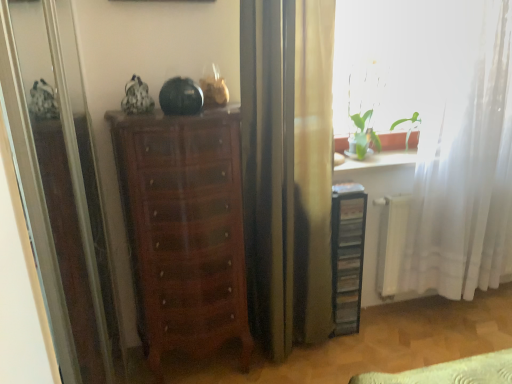
Question: From the image's perspective, is shiny brown chest of drawers at center located beneath transparent glass screen door at left?

Choices:
 (A) no
 (B) yes

Answer: (B)

Question: From the image's perspective, is shiny brown chest of drawers at center above transparent glass screen door at left?

Choices:
 (A) yes
 (B) no

Answer: (B)

Question: Is shiny brown chest of drawers at center far away from transparent glass screen door at left?

Choices:
 (A) no
 (B) yes

Answer: (A)

Question: Considering the relative sizes of shiny brown chest of drawers at center and transparent glass screen door at left in the image provided, is shiny brown chest of drawers at center bigger than transparent glass screen door at left?

Choices:
 (A) no
 (B) yes

Answer: (B)

Question: Is shiny brown chest of drawers at center looking in the opposite direction of transparent glass screen door at left?

Choices:
 (A) yes
 (B) no

Answer: (B)

Question: Is shiny brown chest of drawers at center at the right side of transparent glass screen door at left?

Choices:
 (A) no
 (B) yes

Answer: (B)

Question: Is black plastic file cabinet at right at the right side of shiny brown chest of drawers at center?

Choices:
 (A) yes
 (B) no

Answer: (A)

Question: Is black plastic file cabinet at right not within shiny brown chest of drawers at center?

Choices:
 (A) no
 (B) yes

Answer: (B)

Question: Is black plastic file cabinet at right surrounding shiny brown chest of drawers at center?

Choices:
 (A) yes
 (B) no

Answer: (B)

Question: Is black plastic file cabinet at right thinner than shiny brown chest of drawers at center?

Choices:
 (A) yes
 (B) no

Answer: (A)

Question: Can you confirm if black plastic file cabinet at right is wider than shiny brown chest of drawers at center?

Choices:
 (A) no
 (B) yes

Answer: (A)

Question: Could you tell me if black plastic file cabinet at right is facing shiny brown chest of drawers at center?

Choices:
 (A) yes
 (B) no

Answer: (B)

Question: Can you confirm if shiny brown chest of drawers at center is thinner than white sheer curtain at right?

Choices:
 (A) no
 (B) yes

Answer: (A)